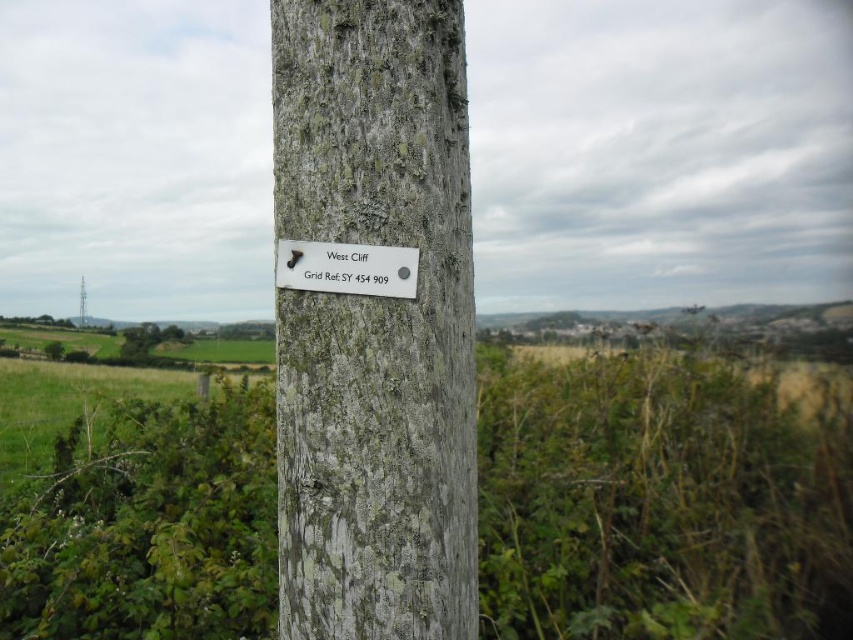
Question: Which point appears closest to the camera in this image?

Choices:
 (A) (444, 435)
 (B) (132, 340)
 (C) (44, 352)

Answer: (A)

Question: Does lichen-covered wood at center appear over gray rough bark tree at center?

Choices:
 (A) yes
 (B) no

Answer: (A)

Question: Does white plastic sign at center lie behind weathered wood telegraph pole at left?

Choices:
 (A) yes
 (B) no

Answer: (B)

Question: Which object is closer to the camera taking this photo?

Choices:
 (A) weathered wood telegraph pole at left
 (B) green rough bark tree at lower left

Answer: (B)

Question: Which object is positioned farthest from the white plastic sign at center?

Choices:
 (A) gray rough bark tree at center
 (B) lichen-covered wood at center

Answer: (A)

Question: Is lichen-covered wood at center below green rough bark tree at lower left?

Choices:
 (A) no
 (B) yes

Answer: (A)